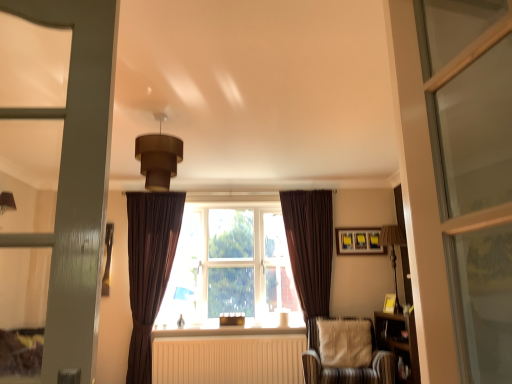
You are a GUI agent. You are given a task and a screenshot of the screen. Output one action in this format:
    pyautogui.click(x=<x>, y=<y>)
    Task: Click on the vacant point above white matte radiator at center (from a real-world perspective)
    This screenshot has width=512, height=384.
    Given the screenshot: What is the action you would take?
    pyautogui.click(x=234, y=334)